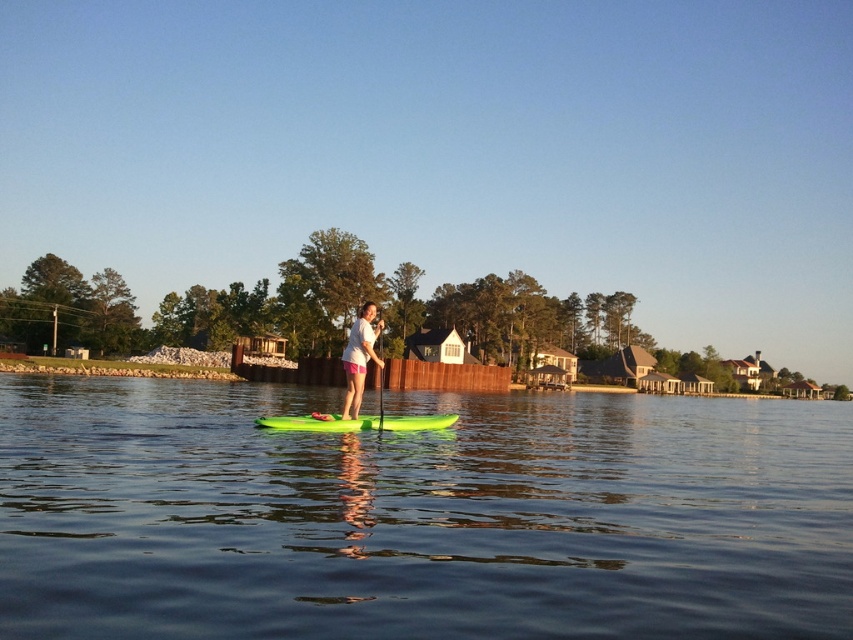
Is green rubber paddleboard at center below white matte shirt at center?

Correct, green rubber paddleboard at center is located below white matte shirt at center.

Where is `green rubber paddleboard at center`? The width and height of the screenshot is (853, 640). green rubber paddleboard at center is located at coordinates (419, 515).

Who is more distant from viewer, (769, 525) or (354, 352)?

Point (354, 352)

You are a GUI agent. You are given a task and a screenshot of the screen. Output one action in this format:
    pyautogui.click(x=<x>, y=<y>)
    Task: Click on the green rubber paddleboard at center
    This screenshot has width=853, height=640.
    Given the screenshot: What is the action you would take?
    pyautogui.click(x=419, y=515)

Can you confirm if green rubber paddleboard at center is positioned below green rubber paddle at center?

Yes.

Is the position of green rubber paddleboard at center less distant than that of green rubber paddle at center?

Yes, green rubber paddleboard at center is closer to the viewer.

Between point (743, 556) and point (379, 368), which one is positioned in front?

Positioned in front is point (743, 556).

Locate an element on the screen. The width and height of the screenshot is (853, 640). green rubber paddleboard at center is located at coordinates (419, 515).

Which is below, green rubber canoe at center or white matte shirt at center?

Positioned lower is green rubber canoe at center.

Can you confirm if green rubber canoe at center is shorter than white matte shirt at center?

Yes, green rubber canoe at center is shorter than white matte shirt at center.

Which is in front, point (403, 429) or point (370, 301)?

Point (403, 429)

Where is `green rubber canoe at center`? The width and height of the screenshot is (853, 640). green rubber canoe at center is located at coordinates (318, 422).